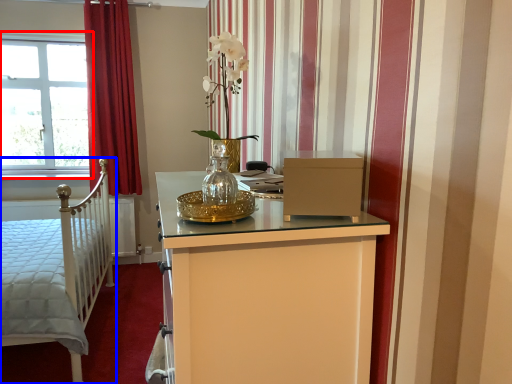
Question: Which of the following is the farthest to the observer, window (highlighted by a red box) or bed (highlighted by a blue box)?

Choices:
 (A) window
 (B) bed

Answer: (A)